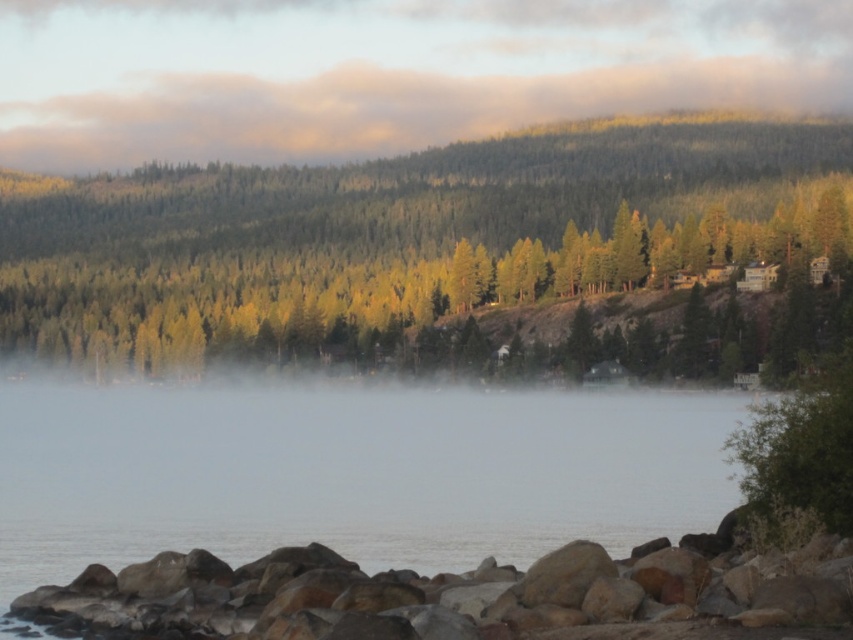
You are an outdoor photographer planning to capture the green textured trees at center and the foggy mist at upper center in a single shot. Based on their positions, can you determine which one will appear closer to the camera in the final photograph?

The green textured trees at center is in front of foggy mist at upper center, so the green textured trees at center will appear closer to the camera in the final photograph.

You are standing on the lakeshore and want to take a photo of the green textured trees at center and the foggy mist at upper center. Which object should you focus on first if you want to capture both in a single frame without moving the camera?

You should focus on the green textured trees at center first because it is located below the foggy mist at upper center, so adjusting the camera to include both would require ensuring the lower object is in frame before the upper one.